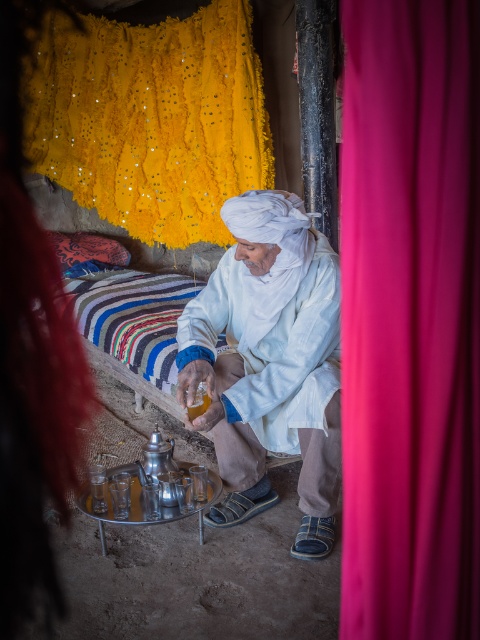
Image resolution: width=480 pixels, height=640 pixels. What do you see at coordinates (409, 320) in the screenshot?
I see `velvet-like pink curtain at right` at bounding box center [409, 320].

Who is lower down, velvet-like pink curtain at right or white cotton turban at center?

Positioned lower is white cotton turban at center.

Which is in front, point (397, 150) or point (299, 422)?

Point (397, 150) is in front.

The image size is (480, 640). I want to click on velvet-like pink curtain at right, so click(409, 320).

From the picture: Between velvet-like pink curtain at right and shiny yellow fabric at upper left, which one has more height?

shiny yellow fabric at upper left is taller.

Which of these two, velvet-like pink curtain at right or shiny yellow fabric at upper left, stands shorter?

velvet-like pink curtain at right is shorter.

Is point (430, 157) more distant than point (193, 84)?

No, it is not.

Locate an element on the screen. velvet-like pink curtain at right is located at coordinates (409, 320).

Between shiny yellow fabric at upper left and white cotton turban at center, which one is positioned lower?

white cotton turban at center

Between shiny yellow fabric at upper left and white cotton turban at center, which one is positioned higher?

Positioned higher is shiny yellow fabric at upper left.

Where is `shiny yellow fabric at upper left`? shiny yellow fabric at upper left is located at coordinates (151, 118).